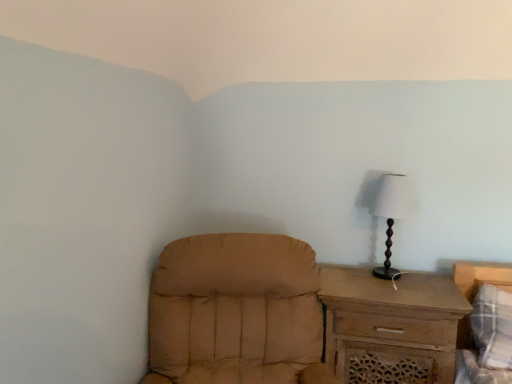
Question: Is tan fabric chair at lower left to the left of white fabric lampshade at right from the viewer's perspective?

Choices:
 (A) yes
 (B) no

Answer: (A)

Question: Does tan fabric chair at lower left come in front of white fabric lampshade at right?

Choices:
 (A) yes
 (B) no

Answer: (A)

Question: Does tan fabric chair at lower left lie behind white fabric lampshade at right?

Choices:
 (A) no
 (B) yes

Answer: (A)

Question: Is white fabric lampshade at right at the back of tan fabric chair at lower left?

Choices:
 (A) no
 (B) yes

Answer: (A)

Question: Is tan fabric chair at lower left oriented towards white fabric lampshade at right?

Choices:
 (A) yes
 (B) no

Answer: (B)

Question: In terms of width, does white fabric lampshade at right look wider or thinner when compared to brown wooden chest of drawers at right?

Choices:
 (A) thin
 (B) wide

Answer: (A)

Question: Is white fabric lampshade at right spatially inside brown wooden chest of drawers at right, or outside of it?

Choices:
 (A) outside
 (B) inside

Answer: (A)

Question: In terms of size, does white fabric lampshade at right appear bigger or smaller than brown wooden chest of drawers at right?

Choices:
 (A) small
 (B) big

Answer: (A)

Question: Is point (402, 205) closer or farther from the camera than point (429, 316)?

Choices:
 (A) farther
 (B) closer

Answer: (A)

Question: Would you say tan fabric chair at lower left is inside or outside brown wooden chest of drawers at right?

Choices:
 (A) inside
 (B) outside

Answer: (B)

Question: From their relative heights in the image, would you say tan fabric chair at lower left is taller or shorter than brown wooden chest of drawers at right?

Choices:
 (A) short
 (B) tall

Answer: (B)

Question: From a real-world perspective, is tan fabric chair at lower left physically located above or below brown wooden chest of drawers at right?

Choices:
 (A) below
 (B) above

Answer: (B)

Question: Is point (206, 235) positioned closer to the camera than point (415, 334)?

Choices:
 (A) closer
 (B) farther

Answer: (B)

Question: Considering the positions of tan fabric chair at lower left and plaid fabric bed at lower right in the image, is tan fabric chair at lower left bigger or smaller than plaid fabric bed at lower right?

Choices:
 (A) small
 (B) big

Answer: (B)

Question: Is tan fabric chair at lower left inside or outside of plaid fabric bed at lower right?

Choices:
 (A) inside
 (B) outside

Answer: (B)